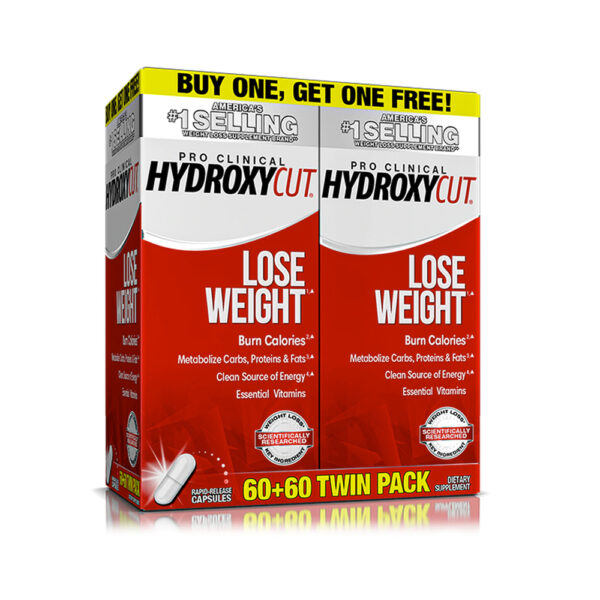
You are a GUI agent. You are given a task and a screenshot of the screen. Output one action in this format:
    pyautogui.click(x=<x>, y=<y>)
    Task: Click on the boxes
    
    Given the screenshot: What is the action you would take?
    pyautogui.click(x=172, y=334)